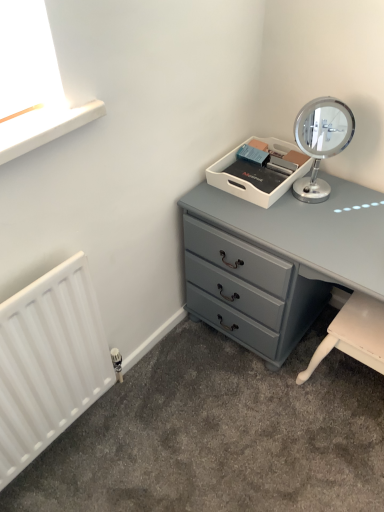
This screenshot has height=512, width=384. Find the location of `free point in front of polished chrome mirror at upper right`. free point in front of polished chrome mirror at upper right is located at coordinates (321, 224).